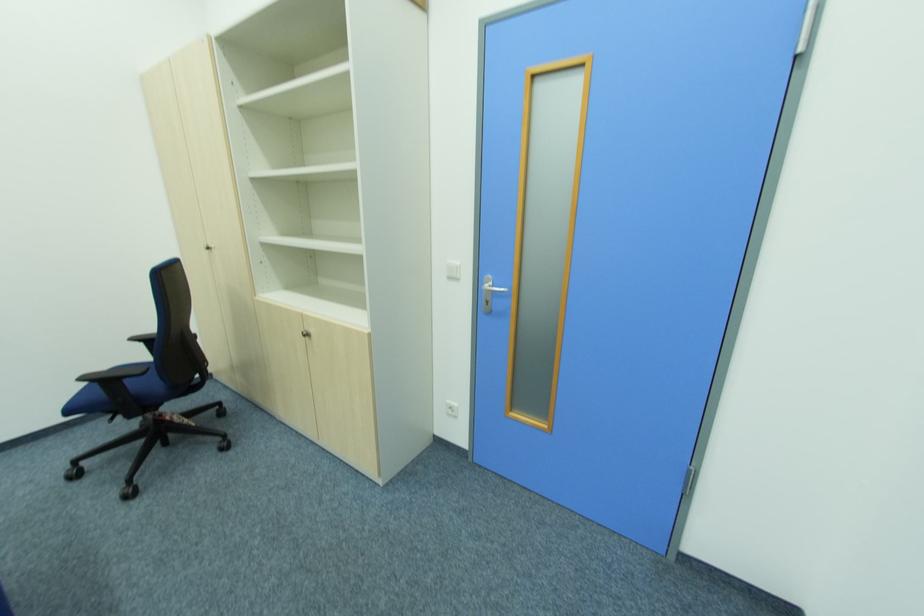
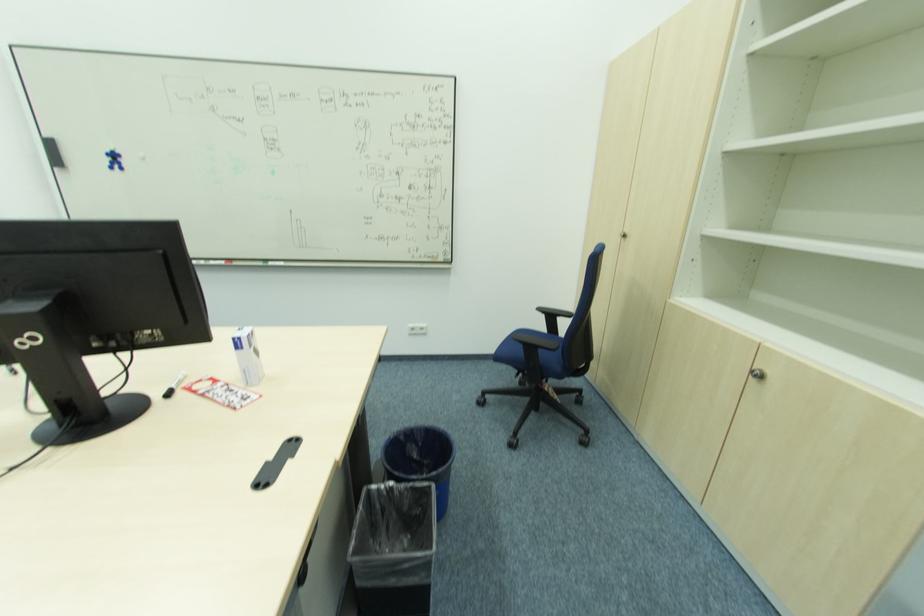
Question: The camera is either moving clockwise (left) or counter-clockwise (right) around the object. The first image is from the beginning of the video and the second image is from the end. Is the camera moving left or right when shooting the video?

Choices:
 (A) Left
 (B) Right

Answer: (B)